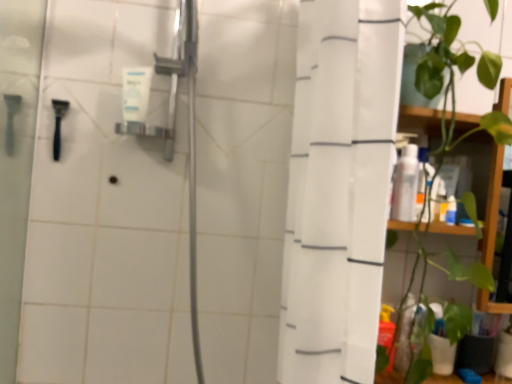
Question: Does white matte tube at upper center, marked as the first toiletry in a left-to-right arrangement, have a larger size compared to green leafy plant at right?

Choices:
 (A) yes
 (B) no

Answer: (B)

Question: Is white matte tube at upper center, acting as the second toiletry starting from the right, next to green leafy plant at right and touching it?

Choices:
 (A) yes
 (B) no

Answer: (B)

Question: Could green leafy plant at right be considered to be inside white matte tube at upper center, which is the first toiletry in top-to-bottom order?

Choices:
 (A) no
 (B) yes

Answer: (A)

Question: Is white matte tube at upper center, acting as the second toiletry starting from the right, oriented towards green leafy plant at right?

Choices:
 (A) no
 (B) yes

Answer: (A)

Question: From the image's perspective, would you say white matte tube at upper center, which is the first toiletry in top-to-bottom order, is shown under green leafy plant at right?

Choices:
 (A) yes
 (B) no

Answer: (B)

Question: Is white matte tube at upper center, which is the first toiletry in top-to-bottom order, turned away from green leafy plant at right?

Choices:
 (A) yes
 (B) no

Answer: (B)

Question: Does white matte tube at upper center, marked as the first toiletry in a left-to-right arrangement, appear on the right side of black plastic razor at left?

Choices:
 (A) no
 (B) yes

Answer: (B)

Question: Is white matte tube at upper center, which is the first toiletry in top-to-bottom order, taller than black plastic razor at left?

Choices:
 (A) yes
 (B) no

Answer: (B)

Question: Considering the relative sizes of white matte tube at upper center, the 2th toiletry positioned from the bottom, and black plastic razor at left in the image provided, is white matte tube at upper center, the 2th toiletry positioned from the bottom, bigger than black plastic razor at left?

Choices:
 (A) no
 (B) yes

Answer: (B)

Question: Is white matte tube at upper center, marked as the first toiletry in a left-to-right arrangement, wider than black plastic razor at left?

Choices:
 (A) yes
 (B) no

Answer: (A)

Question: Is white matte tube at upper center, acting as the second toiletry starting from the right, shorter than black plastic razor at left?

Choices:
 (A) no
 (B) yes

Answer: (B)

Question: Is white matte tube at upper center, which is the first toiletry in top-to-bottom order, next to black plastic razor at left?

Choices:
 (A) no
 (B) yes

Answer: (A)

Question: Can you confirm if white matte tube at upper center, marked as the first toiletry in a left-to-right arrangement, is taller than white glossy bottle at right, marked as the first toiletry in a bottom-to-top arrangement?

Choices:
 (A) yes
 (B) no

Answer: (B)